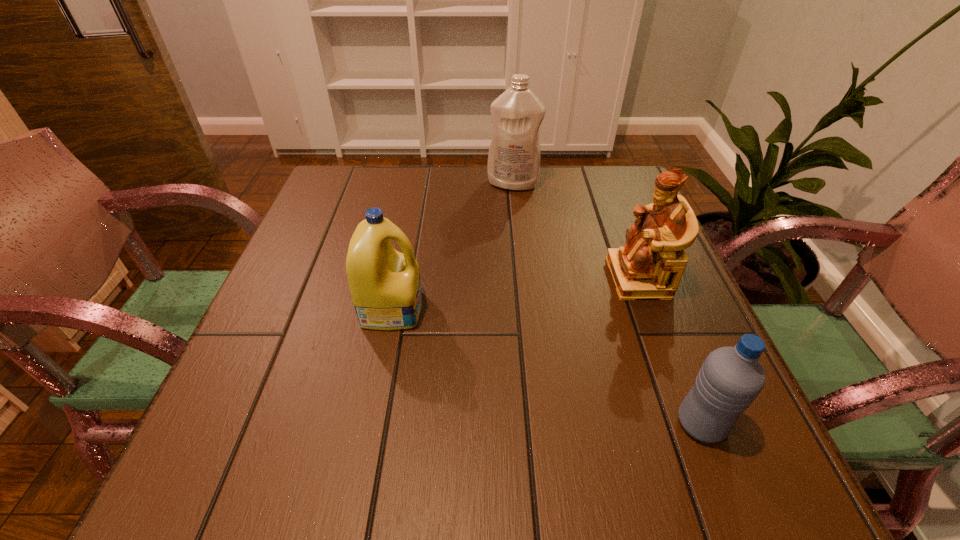
Locate an element on the screen. This screenshot has height=540, width=960. free spot at the right edge of the desktop is located at coordinates pyautogui.click(x=644, y=407).

This screenshot has height=540, width=960. I want to click on blank space at the far left corner of the desktop, so click(x=331, y=200).

Identify the location of vacant area at the near left corner. (245, 447).

You are a GUI agent. You are given a task and a screenshot of the screen. Output one action in this format:
    pyautogui.click(x=<x>, y=<y>)
    Task: Click on the vacant area at the far right corner of the desktop
    Image resolution: width=960 pixels, height=540 pixels.
    Given the screenshot: What is the action you would take?
    pyautogui.click(x=590, y=172)

This screenshot has height=540, width=960. I want to click on vacant region between the figurine and the water bottle, so click(x=670, y=350).

In order to click on vacant area that lies between the shorter detergent and the figurine in this screenshot , I will do `click(516, 293)`.

I want to click on blank region between the nearer detergent and the second object from left to right, so click(x=452, y=246).

What are the coordinates of `empty space that is in between the shorter detergent and the figurine` in the screenshot? It's located at (516, 293).

This screenshot has width=960, height=540. In order to click on free space between the figurine and the right detergent in this screenshot , I will do `click(576, 231)`.

Find the location of a particular element. The width and height of the screenshot is (960, 540). free spot between the figurine and the shorter detergent is located at coordinates (516, 293).